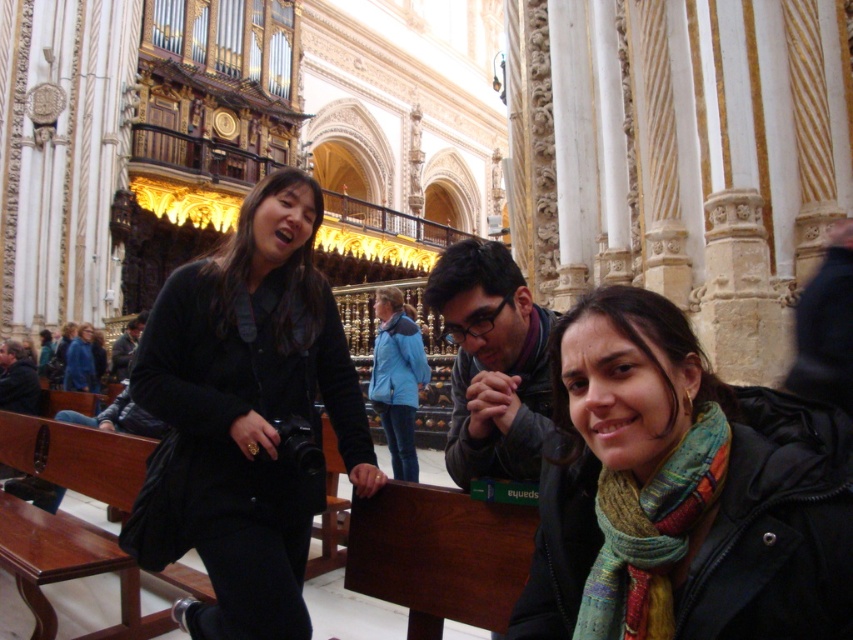
You are an interior designer planning to add a new decorative element to the cathedral. You have a small golden statue that is the same size as the matte black jacket at center. Will the multicolored scarf at lower right be able to accommodate the statue if placed on top of it?

The multicolored scarf at lower right is larger in size than the matte black jacket at center. Since the statue is the same size as the matte black jacket at center, it should fit comfortably on top of the multicolored scarf at lower right without any issues.

You are standing at the entrance of the cathedral and want to take a photo of both the black matte jacket at center and the dark gray jacket at center. However, your camera has a maximum focus range of 30 meters. Can you capture both jackets in focus without moving closer?

The black matte jacket at center is 33.11 meters away from the dark gray jacket at center. Since the distance between them exceeds the camera maximum focus range of 30 meters, you cannot capture both jackets in focus without moving closer.

You are standing in the cathedral and want to take a photo of the black matte jacket at center. The camera you have is 21.35 meters away from the jacket. Can you capture the entire jacket in one photo without moving the camera?

The camera and the black matte jacket at center are 21.35 meters apart. Since the camera is positioned at that distance, you can capture the entire jacket in one photo without needing to move the camera.